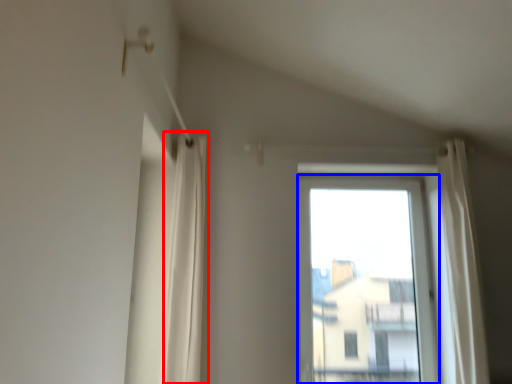
Question: Which object is further to the camera taking this photo, shower curtain (highlighted by a red box) or window (highlighted by a blue box)?

Choices:
 (A) shower curtain
 (B) window

Answer: (B)